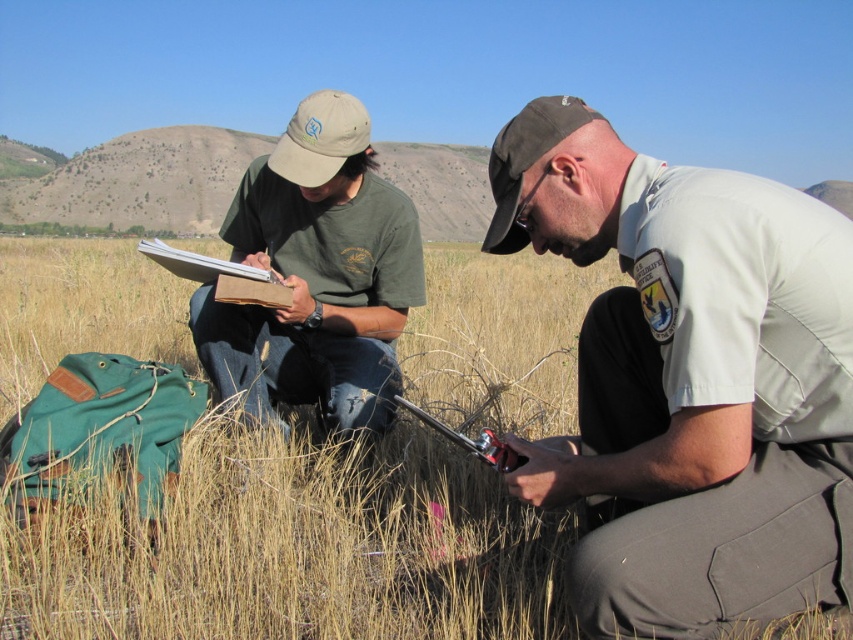
Question: Which point appears closest to the camera in this image?

Choices:
 (A) (349, 468)
 (B) (207, 301)

Answer: (A)

Question: Is dry grass at center bigger than green matte t-shirt at left?

Choices:
 (A) no
 (B) yes

Answer: (B)

Question: Estimate the real-world distances between objects in this image. Which object is farther from the green matte t-shirt at left?

Choices:
 (A) tan uniform at center
 (B) dry grass at center

Answer: (B)

Question: In this image, where is dry grass at center located relative to tan uniform at center?

Choices:
 (A) left
 (B) right

Answer: (A)

Question: Can you confirm if tan uniform at center is bigger than green matte t-shirt at left?

Choices:
 (A) yes
 (B) no

Answer: (A)

Question: Which object is closer to the camera taking this photo?

Choices:
 (A) dry grass at center
 (B) green matte t-shirt at left
 (C) tan uniform at center

Answer: (C)